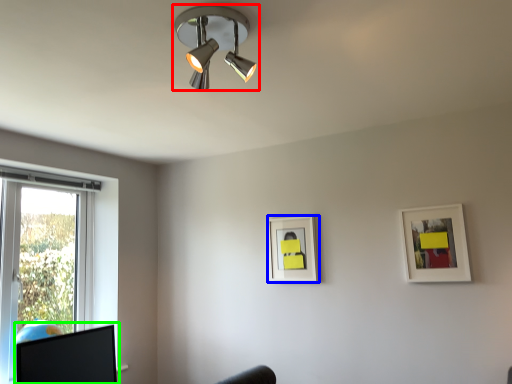
Question: Which object is positioned closest to lamp (highlighted by a red box)? Select from picture frame (highlighted by a blue box) and computer monitor (highlighted by a green box).

Choices:
 (A) picture frame
 (B) computer monitor

Answer: (A)